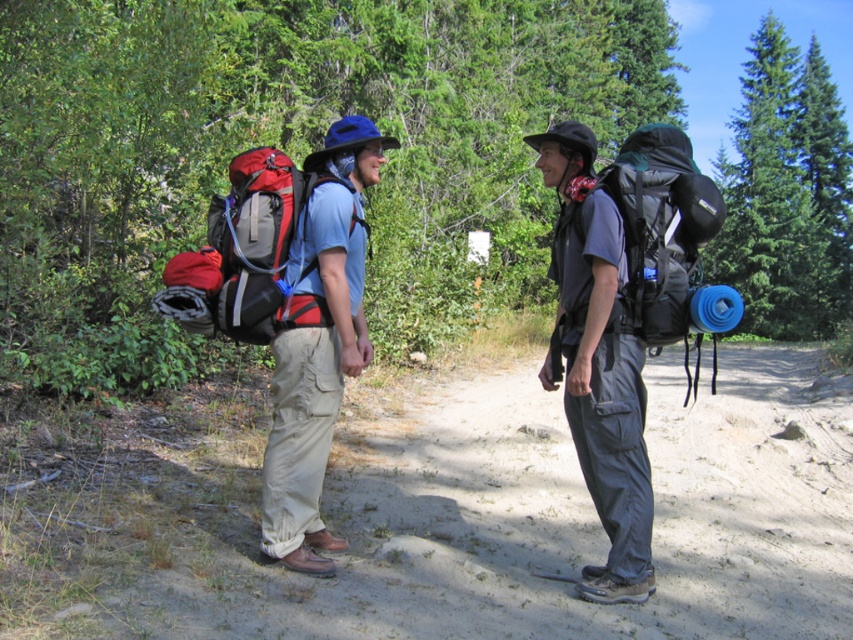
Who is more distant from viewer, (x=175, y=472) or (x=583, y=456)?

Point (x=175, y=472)

Which is behind, point (547, 451) or point (621, 225)?

Positioned behind is point (547, 451).

Identify the location of dirt track at center. (453, 516).

Is point (590, 166) farther from viewer compared to point (326, 365)?

That is True.

Does gray fabric backpack at center have a smaller size compared to matte blue backpack at center?

No.

Identify the location of gray fabric backpack at center. (598, 362).

Where is `dirt track at center`? Image resolution: width=853 pixels, height=640 pixels. dirt track at center is located at coordinates (453, 516).

Which is below, dirt track at center or matte blue backpack at center?

dirt track at center is lower down.

Between point (665, 561) and point (300, 268), which one is positioned in front?

Point (300, 268)

Locate an element on the screen. The image size is (853, 640). dirt track at center is located at coordinates (453, 516).